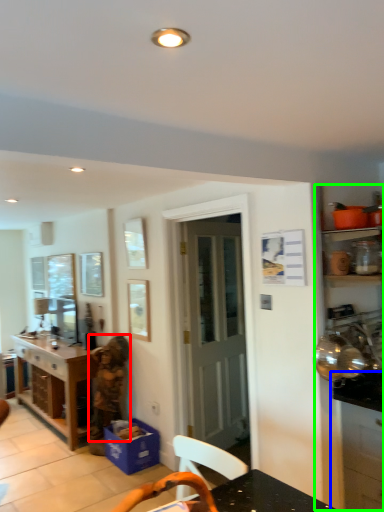
Question: Considering the real-world distances, which object is farthest from person (highlighted by a red box)? cabinetry (highlighted by a blue box) or dresser (highlighted by a green box)?

Choices:
 (A) cabinetry
 (B) dresser

Answer: (A)